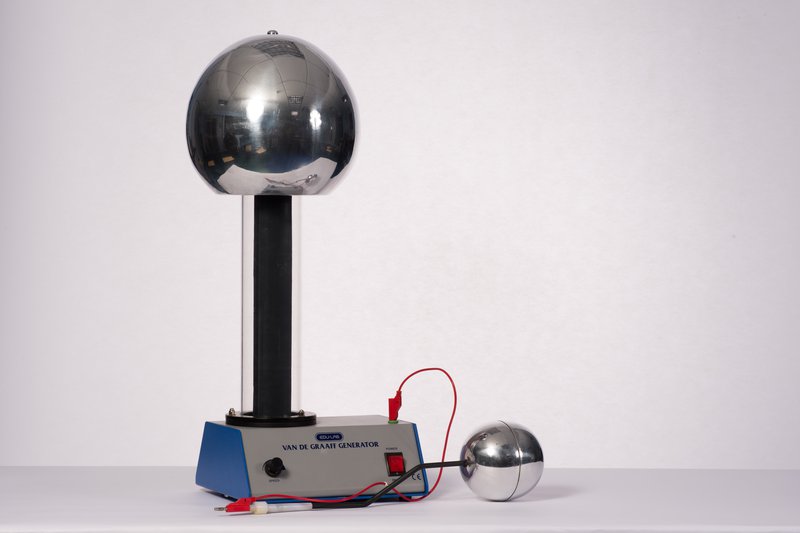
Identify the location of knob. (274, 464).